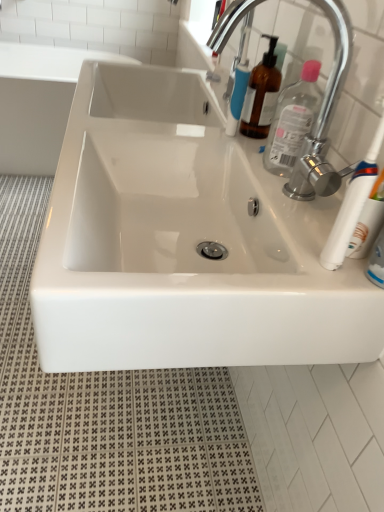
Question: In terms of size, does clear plastic bottle at upper right appear bigger or smaller than white glossy sink at upper left?

Choices:
 (A) small
 (B) big

Answer: (A)

Question: From the image's perspective, is clear plastic bottle at upper right above or below white glossy sink at upper left?

Choices:
 (A) above
 (B) below

Answer: (B)

Question: Considering the real-world distances, which object is closest to the white glossy sink at upper left?

Choices:
 (A) clear plastic bottle at upper right
 (B) white plastic toothbrush at right
 (C) white glossy sink at center
 (D) chrome metallic faucet at upper right

Answer: (C)

Question: Considering the real-world distances, which object is farthest from the white plastic toothbrush at right?

Choices:
 (A) white glossy sink at center
 (B) white glossy sink at upper left
 (C) clear plastic bottle at upper right
 (D) chrome metallic faucet at upper right

Answer: (B)